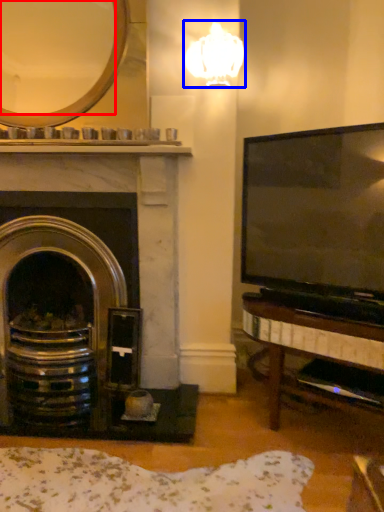
Question: Which point is closer to the camera, mirror (highlighted by a red box) or lamp (highlighted by a blue box)?

Choices:
 (A) mirror
 (B) lamp

Answer: (B)